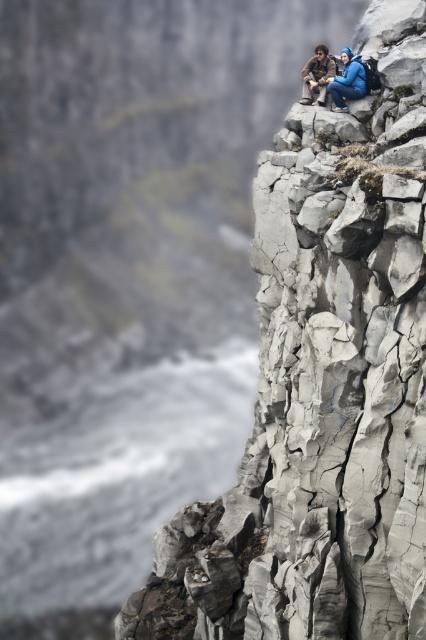
Question: Which of the following is the closest to the observer?

Choices:
 (A) blue fabric jacket at upper center
 (B) brown leather jacket at upper center
 (C) gray cracked rock at upper center

Answer: (C)

Question: Can you confirm if gray cracked rock at upper center is positioned to the left of brown leather jacket at upper center?

Choices:
 (A) no
 (B) yes

Answer: (B)

Question: Is gray cracked rock at upper center smaller than blue fabric jacket at upper center?

Choices:
 (A) yes
 (B) no

Answer: (B)

Question: Can you confirm if gray cracked rock at upper center is positioned above blue fabric jacket at upper center?

Choices:
 (A) no
 (B) yes

Answer: (A)

Question: Based on their relative distances, which object is farther from the gray cracked rock at upper center?

Choices:
 (A) blue fabric jacket at upper center
 (B) brown leather jacket at upper center

Answer: (B)

Question: Which object is farther from the camera taking this photo?

Choices:
 (A) blue fabric jacket at upper center
 (B) brown leather jacket at upper center

Answer: (B)